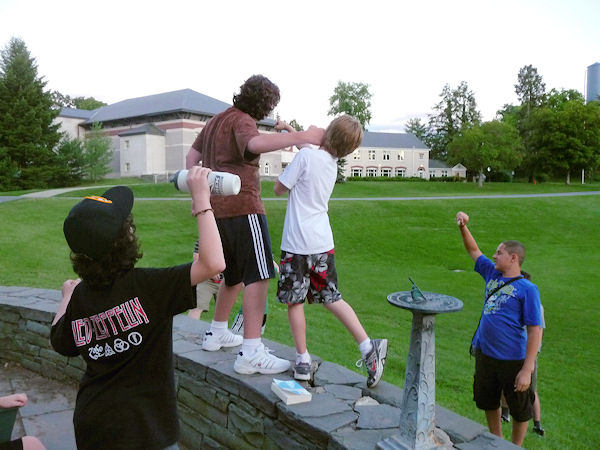
The height and width of the screenshot is (450, 600). Identify the location of rock floor. (36, 410).